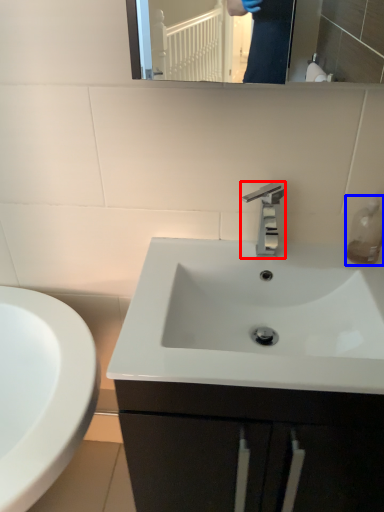
Question: Which of the following is the closest to the observer, tap (highlighted by a red box) or soap dispenser (highlighted by a blue box)?

Choices:
 (A) tap
 (B) soap dispenser

Answer: (A)